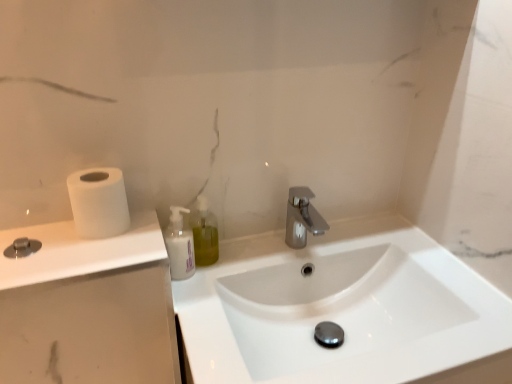
The image size is (512, 384). What are the coordinates of `vacant space in front of translucent plastic soap dispenser at center` in the screenshot? It's located at (200, 296).